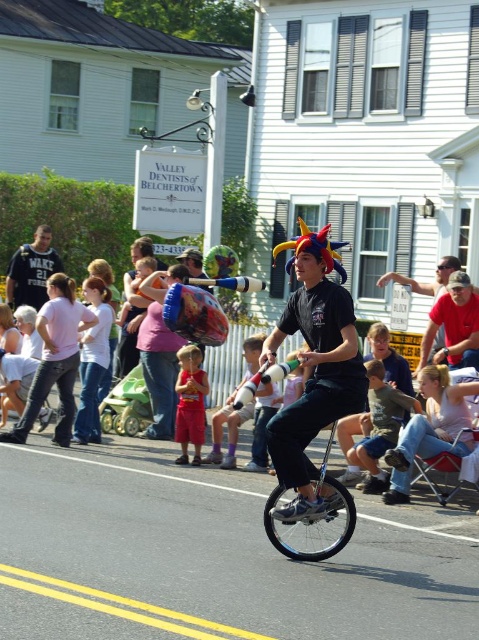
You are standing at the center of the street and want to move to the denim jeans at lower right. Which direction should you move to reach them?

You should move to the lower right direction to reach the denim jeans at lower right as they are located at point (431, 428).

You are a photographer standing at the edge of the crowd. You want to take a photo that includes both the denim jeans at lower right and the matte black shirt at center. Based on their positions, which object should you focus on first to ensure both are in the frame?

The denim jeans at lower right is located below the matte black shirt at center. To include both in the frame, focus on the matte black shirt at center first as it is higher up, then adjust the camera angle downward to include the denim jeans at lower right.

You are a photographer standing at the center of the street, and you want to take a picture of the pink cotton shirt at lower left. Which direction should you move to get the shirt into the frame?

The pink cotton shirt at lower left is located at point 0.562 on the x axis and 0.117 on the y axis. Since you are at the center, you should move to the left and down to position yourself closer to the shirt.